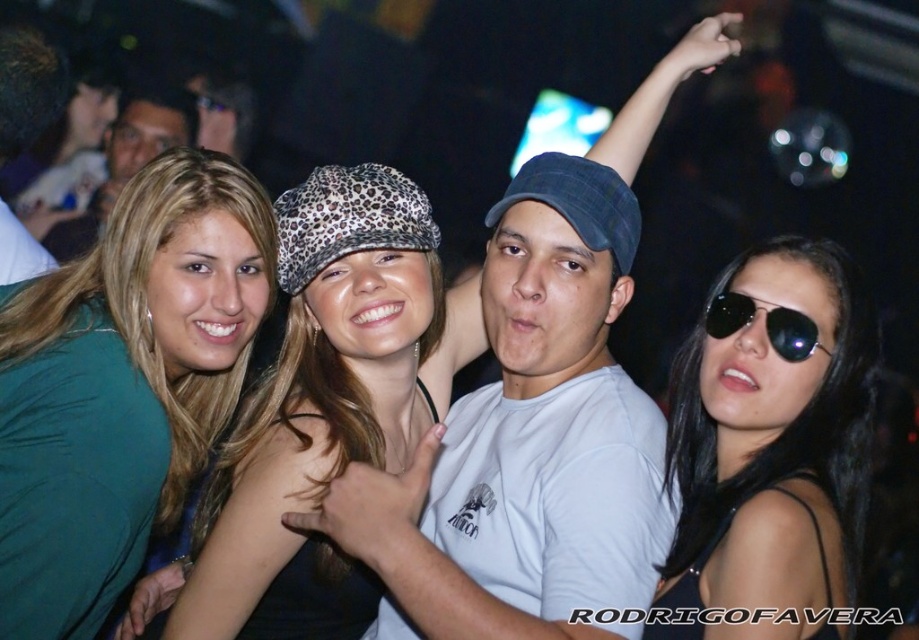
Based on the scene description, can you determine the spatial relationship between the green fabric shirt at upper left and the black aviator sunglasses at right?

The green fabric shirt at upper left is positioned below the black aviator sunglasses at right.

You are a photographer trying to capture the leopard print hat at center and the matte black tank top at center in the same frame. Which one is closer to the camera?

The leopard print hat at center is closer to the camera because it is in front of the matte black tank top at center.